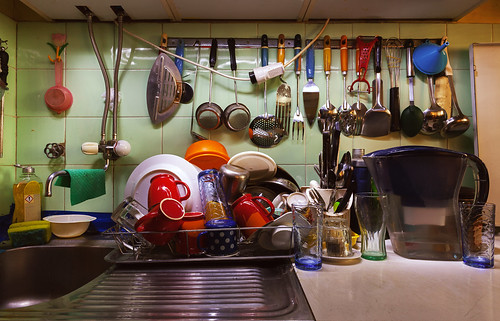
This screenshot has height=321, width=500. I want to click on silverware, so click(346, 194), click(335, 137), click(328, 140), click(321, 201), click(347, 159), click(341, 163), click(330, 179), click(318, 165), click(316, 170).